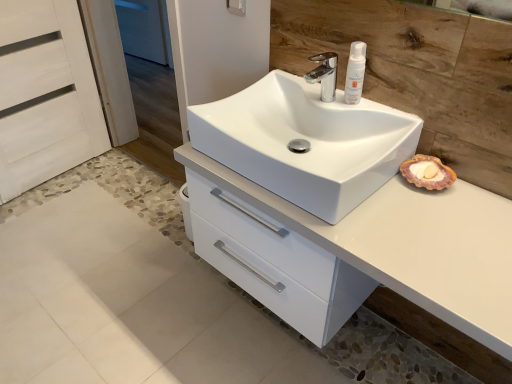
Question: From the image's perspective, is chrome metallic faucet at upper center located above or below white matte lotion at upper right?

Choices:
 (A) below
 (B) above

Answer: (A)

Question: Is point coord(333,64) closer or farther from the camera than point coord(361,61)?

Choices:
 (A) farther
 (B) closer

Answer: (A)

Question: Estimate the real-world distances between objects in this image. Which object is farther from the chrome metallic faucet at upper center?

Choices:
 (A) white wood screen door at left, acting as the second screen door starting from the left
 (B) white glossy sink at center
 (C) white wood screen door at left, arranged as the 1th screen door when viewed from the left
 (D) white matte lotion at upper right
 (E) white glossy cabinet at center

Answer: (A)

Question: Which object is the closest to the white glossy sink at center?

Choices:
 (A) white matte lotion at upper right
 (B) white wood screen door at left, acting as the second screen door starting from the left
 (C) chrome metallic faucet at upper center
 (D) white wood screen door at left, arranged as the 1th screen door when viewed from the left
 (E) white glossy cabinet at center

Answer: (E)